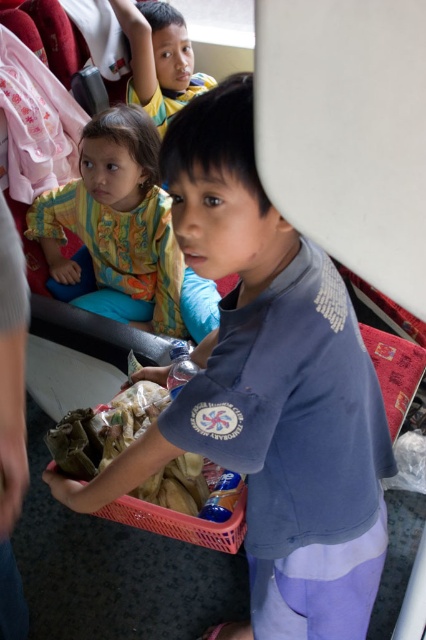
In the scene shown: You are a passenger on a bus and you see a blue cotton shirt at center and a pink plastic basket at center. Which object is closer to you?

The blue cotton shirt at center is closer to the viewer than the pink plastic basket at center.

You are a passenger on a bus and you see a yellow shirt at upper left and a pink plastic basket at center. Which object is located to the left of the other?

The yellow shirt at upper left is positioned on the left side of the pink plastic basket at center.

You are a passenger on a bus and you see a yellow shirt at upper left and a pink plastic basket at center. Which object is located higher in the image?

The yellow shirt at upper left is located higher than the pink plastic basket at center in the image.